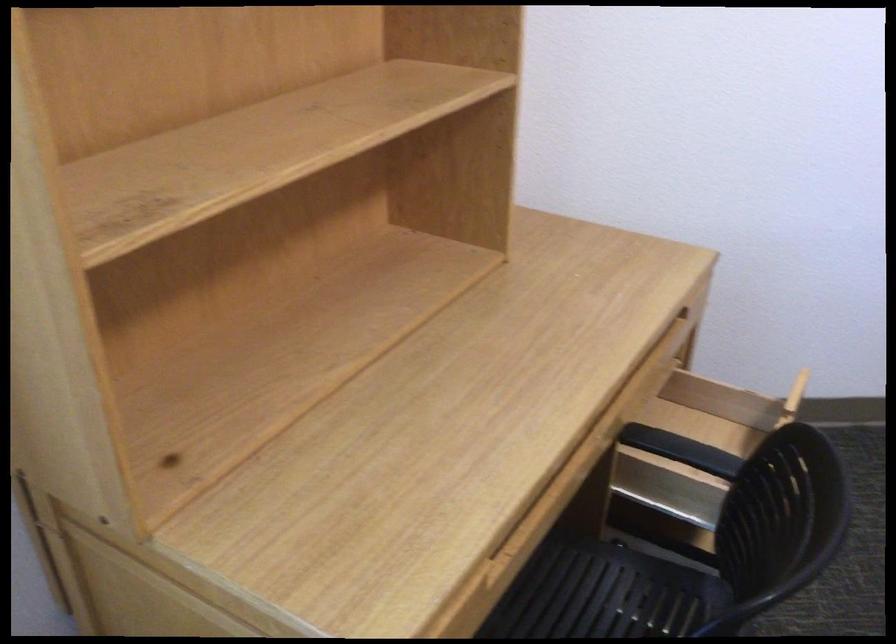
Identify the location of chair sitting surface. (599, 594).